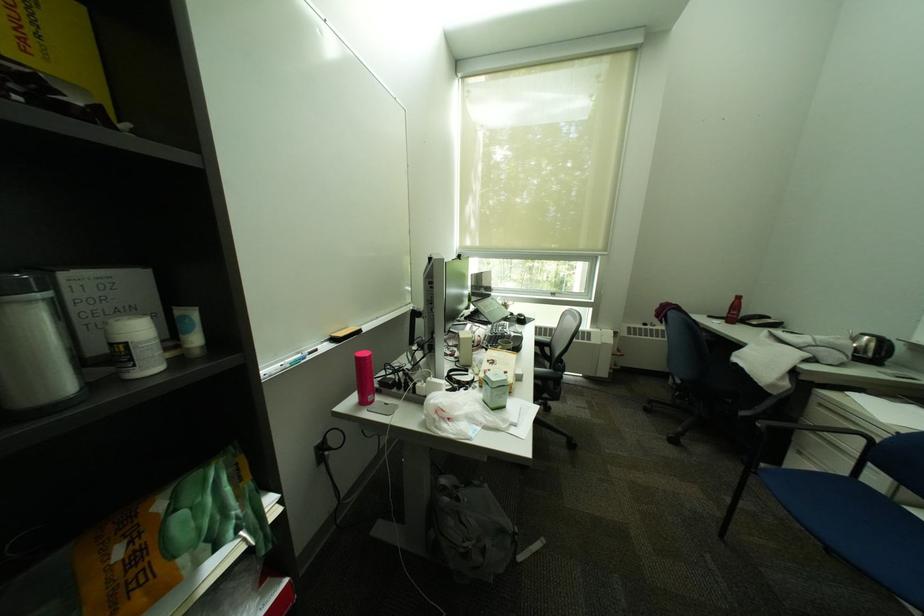
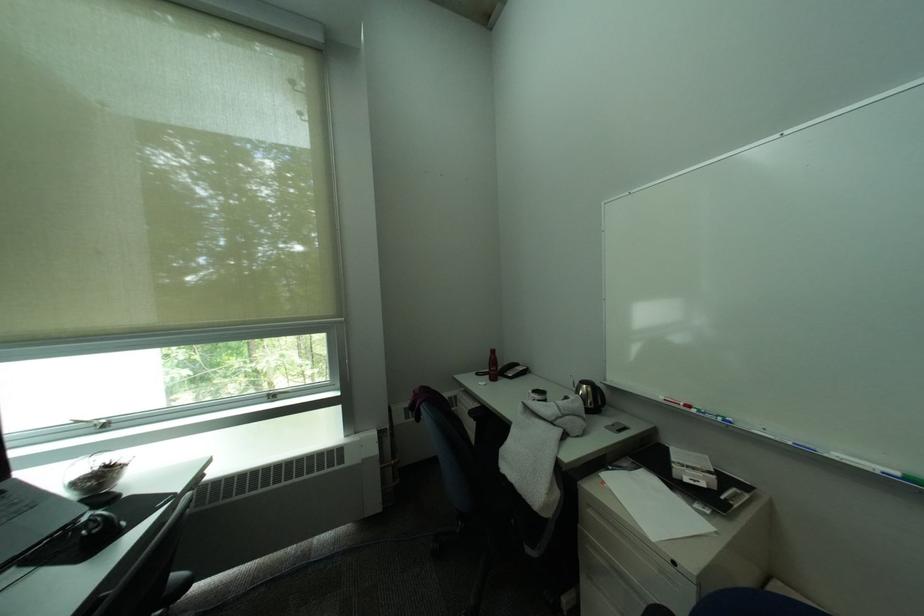
Find the pixel in the second image that matches point (801, 442) in the first image.

(590, 561)